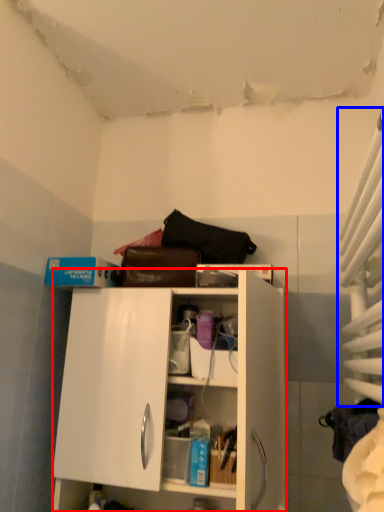
Question: Which object appears closest to the camera in this image, cabinetry (highlighted by a red box) or curtain (highlighted by a blue box)?

Choices:
 (A) cabinetry
 (B) curtain

Answer: (B)